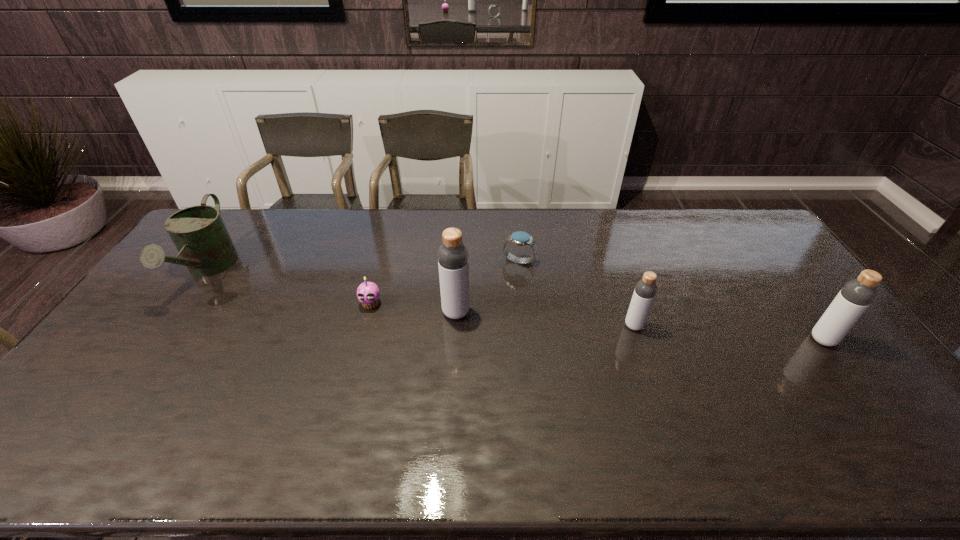
Identify the location of the tallest object. (453, 258).

You are a GUI agent. You are given a task and a screenshot of the screen. Output one action in this format:
    pyautogui.click(x=<x>, y=<y>)
    Task: Click on the leftmost bottle
    
    Given the screenshot: What is the action you would take?
    pyautogui.click(x=453, y=258)

Identify the location of the shortest bottle. The image size is (960, 540). (646, 288).

The width and height of the screenshot is (960, 540). Find the location of `the second object from right to left`. the second object from right to left is located at coordinates (646, 288).

This screenshot has width=960, height=540. Identify the location of the second shortest bottle. (855, 297).

Locate an element on the screen. The image size is (960, 540). the rightmost object is located at coordinates (855, 297).

Locate an element on the screen. The image size is (960, 540). the leftmost object is located at coordinates (198, 232).

Locate an element on the screen. This screenshot has width=960, height=540. watch is located at coordinates (520, 238).

Where is `the second object from left to right`? The width and height of the screenshot is (960, 540). the second object from left to right is located at coordinates (366, 291).

Find the location of `free space located 0.310m on the back of the tallest object`. free space located 0.310m on the back of the tallest object is located at coordinates (460, 241).